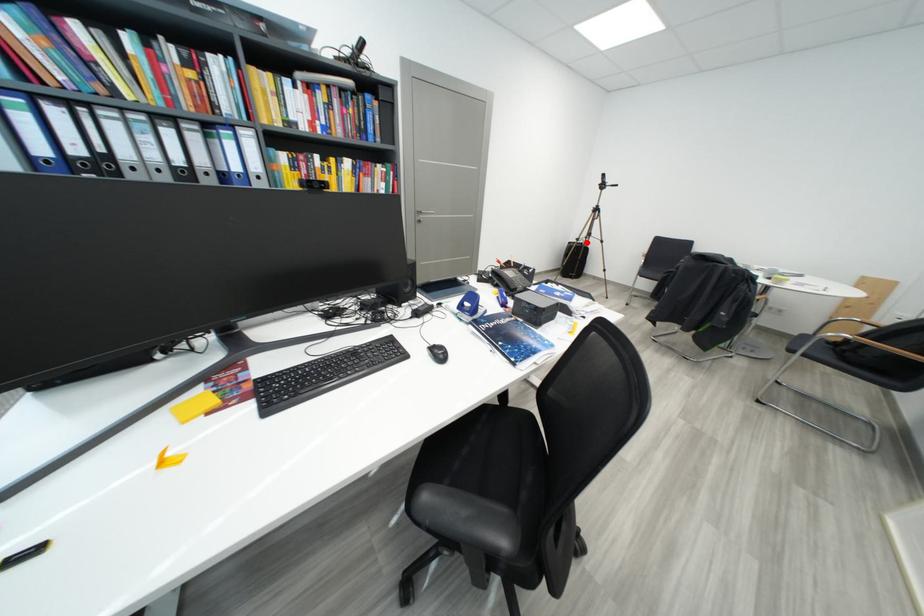
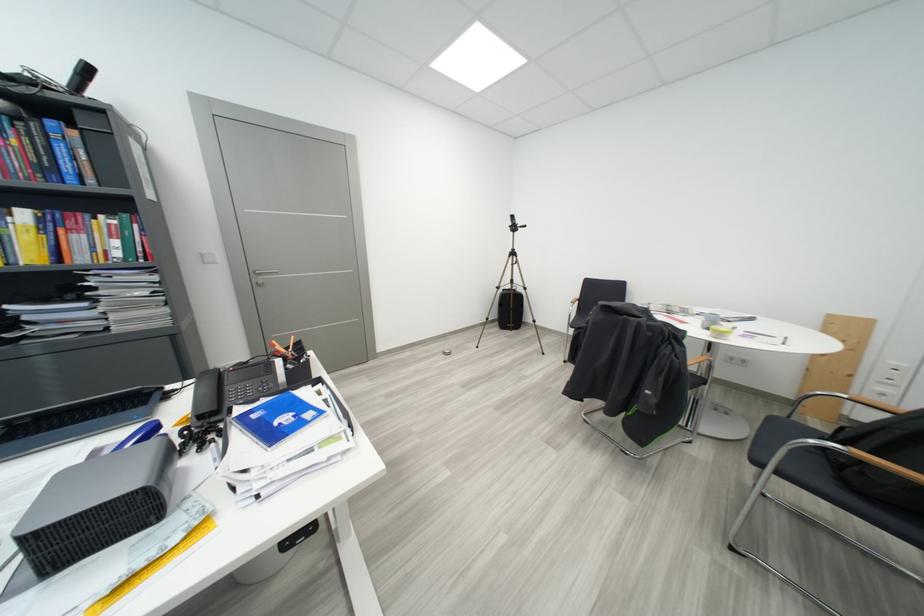
Question: A red point is marked in image1. In image2, is the corresponding 3D point closer to the camera or farther? Reply with the corresponding letter.

Choices:
 (A) The corresponding 3D point is closer.
 (B) The corresponding 3D point is farther.

Answer: (B)